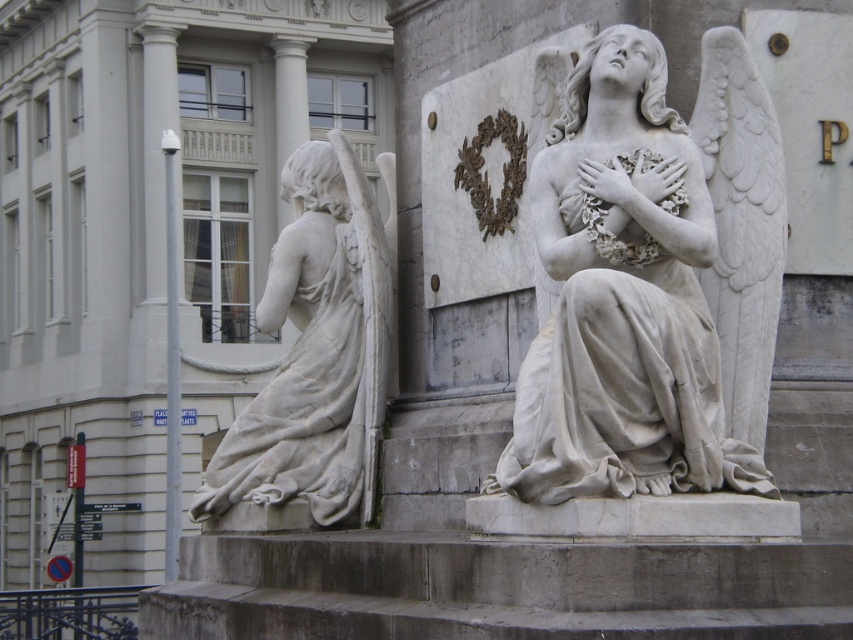
Between white marble statue at center and white marble statue at left, which one has less height?

Standing shorter between the two is white marble statue at center.

Where is `white marble statue at center`? white marble statue at center is located at coordinates (651, 282).

Does point (737, 392) lie in front of point (268, 509)?

That is True.

Where is `white marble statue at center`? white marble statue at center is located at coordinates (651, 282).

Between white marble statue at center and gray concrete stairs at center, which one appears on the right side from the viewer's perspective?

From the viewer's perspective, white marble statue at center appears more on the right side.

Can you confirm if white marble statue at center is positioned below gray concrete stairs at center?

Actually, white marble statue at center is above gray concrete stairs at center.

Between point (637, 268) and point (724, 557), which one is positioned behind?

Point (637, 268)

Locate an element on the screen. The width and height of the screenshot is (853, 640). white marble statue at center is located at coordinates (651, 282).

Image resolution: width=853 pixels, height=640 pixels. I want to click on gray concrete stairs at center, so click(496, 588).

Is gray concrete stairs at center smaller than white marble statue at left?

Incorrect, gray concrete stairs at center is not smaller in size than white marble statue at left.

Is point (426, 618) positioned after point (328, 253)?

No, it is not.

Locate an element on the screen. This screenshot has width=853, height=640. gray concrete stairs at center is located at coordinates click(496, 588).